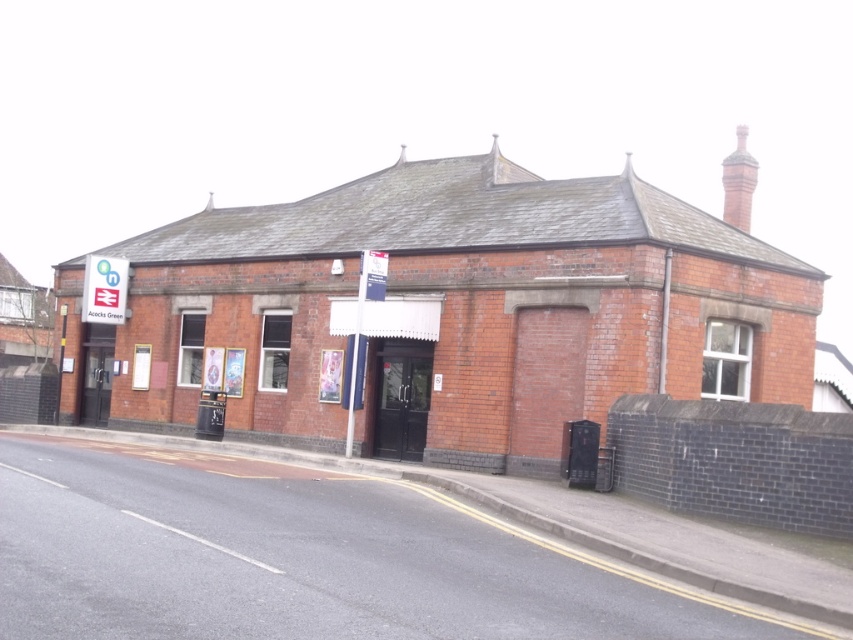
Is white plastic sign at center to the left of white plastic sign at upper left from the viewer's perspective?

No, white plastic sign at center is not to the left of white plastic sign at upper left.

How distant is white plastic sign at center from white plastic sign at upper left?

white plastic sign at center and white plastic sign at upper left are 10.18 meters apart from each other.

This screenshot has height=640, width=853. In order to click on white plastic sign at center in this screenshot , I will do `click(361, 336)`.

Locate an element on the screen. The image size is (853, 640). white plastic sign at center is located at coordinates (361, 336).